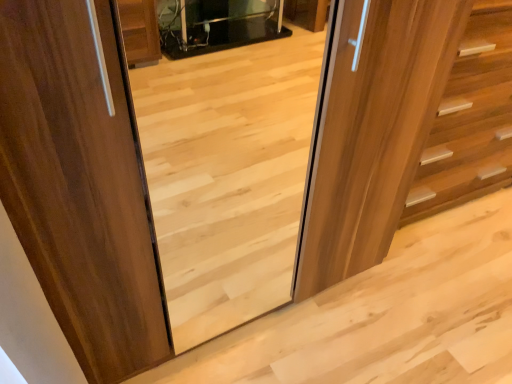
Describe the element at coordinates (373, 130) in the screenshot. I see `wooden door at center` at that location.

Where is `wooden door at center`? The width and height of the screenshot is (512, 384). wooden door at center is located at coordinates pyautogui.click(x=373, y=130).

The height and width of the screenshot is (384, 512). Identify the location of wooden door at center. click(x=373, y=130).